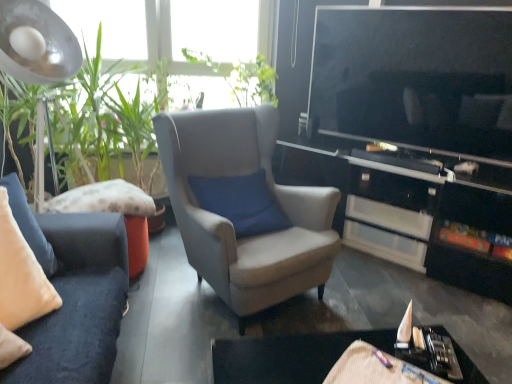
Question: Is green leafy plant at left bigger or smaller than green leafy plant at upper center?

Choices:
 (A) big
 (B) small

Answer: (A)

Question: Is green leafy plant at left taller or shorter than green leafy plant at upper center?

Choices:
 (A) short
 (B) tall

Answer: (B)

Question: Which object is positioned closest to the velvet beige pillow at left?

Choices:
 (A) metallic silver lampshade at upper left
 (B) black glossy table at lower right
 (C) suede-like beige armchair at center
 (D) green leafy plant at left
 (E) green leafy plant at upper center

Answer: (C)

Question: Considering the real-world distances, which object is closest to the green leafy plant at upper center?

Choices:
 (A) metallic silver lampshade at upper left
 (B) black glossy table at lower right
 (C) velvet beige pillow at left
 (D) suede-like beige armchair at center
 (E) black glossy cabinet at center

Answer: (E)